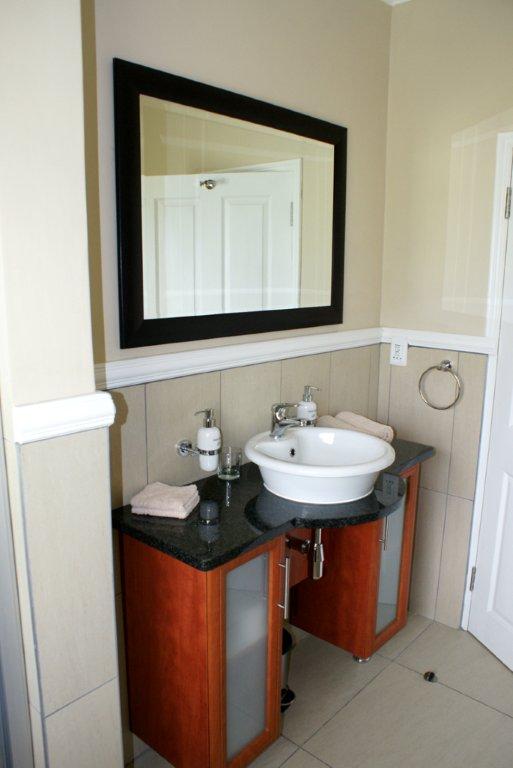
Image resolution: width=513 pixels, height=768 pixels. I want to click on sink, so click(294, 449).